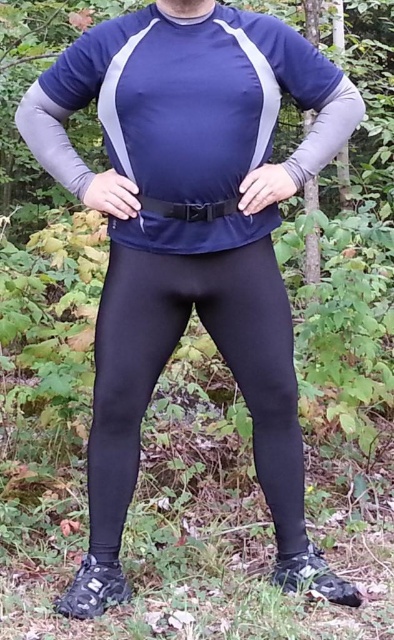
You are an athlete preparing for a photoshoot and need to adjust your outfit. You notice the black matte leggings at center and the black matte belt at center. Which piece of clothing is positioned to the left of the other?

The black matte leggings at center are to the left of the black matte belt at center.

You are a fashion designer analyzing the outfit of a person in a forest scene. You notice the black matte leggings at center and the black matte belt at center. Which of these two items appears bigger in the image?

The black matte leggings at center has a larger size compared to the black matte belt at center, so the leggings appear bigger in the image.